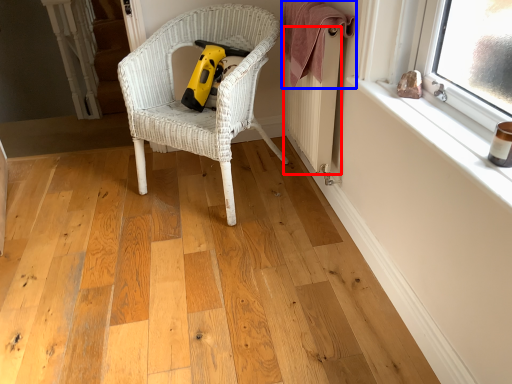
Question: Which object is closer to the camera taking this photo, radiator (highlighted by a red box) or blanket (highlighted by a blue box)?

Choices:
 (A) radiator
 (B) blanket

Answer: (B)